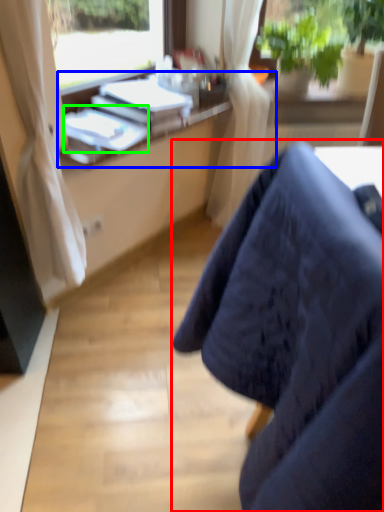
Question: Based on their relative distances, which object is farther from chair (highlighted by a red box)? Choose from desk (highlighted by a blue box) and book (highlighted by a green box).

Choices:
 (A) desk
 (B) book

Answer: (A)